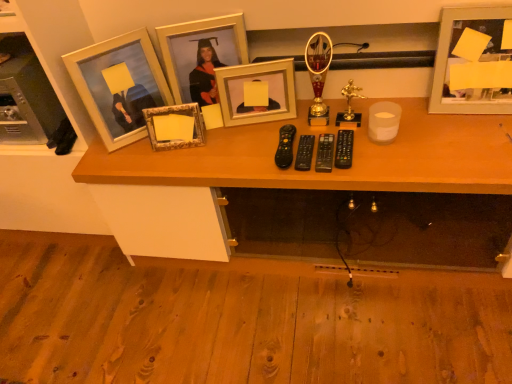
At what (x,y) coordinates should I click in order to perform the action: click on free point in front of gold metallic picture frame at center, which is counted as the 4th picture frame, starting from the left. Please return your answer as a coordinate pair (x, y). Looking at the image, I should click on (253, 144).